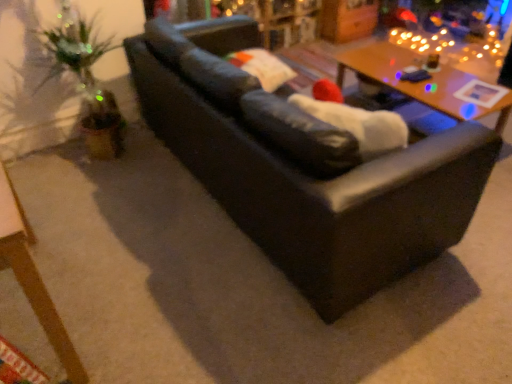
Question: From a real-world perspective, is wooden table at upper right, which is the second table from front to back, positioned above or below matte black couch at center?

Choices:
 (A) above
 (B) below

Answer: (B)

Question: Relative to matte black couch at center, is wooden table at upper right, which is the second table from front to back, in front or behind?

Choices:
 (A) front
 (B) behind

Answer: (B)

Question: Based on their relative distances, which object is farther from the wooden table at lower left, acting as the second table starting from the back?

Choices:
 (A) wooden table at upper right, which is the second table from front to back
 (B) matte black couch at center

Answer: (A)

Question: Considering the real-world distances, which object is closest to the matte black couch at center?

Choices:
 (A) wooden table at lower left, the 1th table positioned from the front
 (B) wooden table at upper right, arranged as the first table when viewed from the right

Answer: (A)